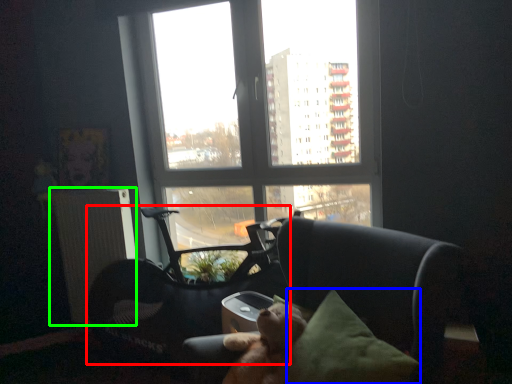
Question: Based on their relative distances, which object is nearer to swivel chair (highlighted by a red box)? Choose from pillow (highlighted by a blue box) and radiator (highlighted by a green box).

Choices:
 (A) pillow
 (B) radiator

Answer: (B)